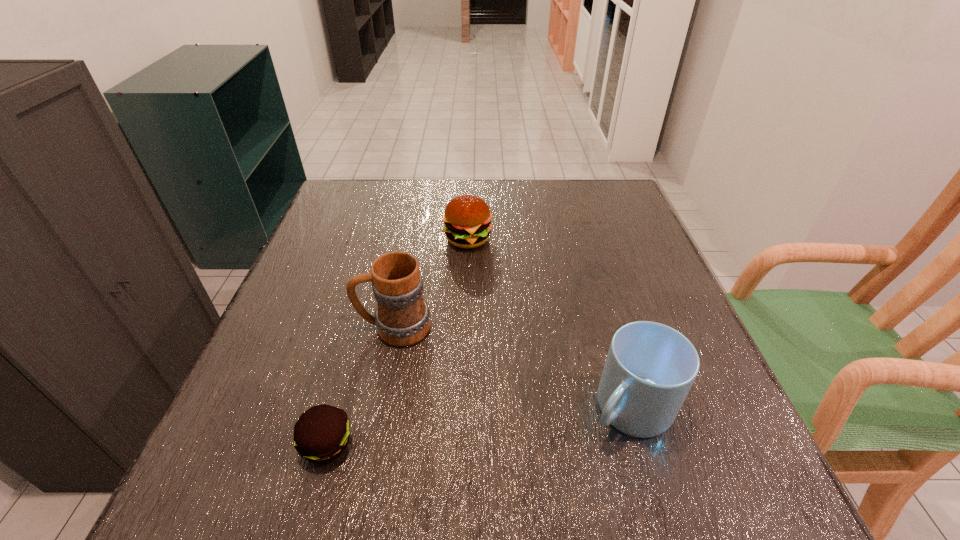
The width and height of the screenshot is (960, 540). Find the location of `unoccupied position between the right mug and the farthest object`. unoccupied position between the right mug and the farthest object is located at coordinates (548, 324).

Identify the location of free area in between the second farthest object and the patty. (360, 386).

The height and width of the screenshot is (540, 960). Identify the location of free point between the nearer mug and the farther mug. (512, 368).

At what (x,y) coordinates should I click in order to perform the action: click on free space between the patty and the rightmost object. Please return your answer as a coordinate pair (x, y). Looking at the image, I should click on (478, 427).

The width and height of the screenshot is (960, 540). Find the location of `free space between the shortest object and the third nearest object`. free space between the shortest object and the third nearest object is located at coordinates (360, 386).

Find the location of a particular element. vacant space in between the second object from right to left and the third nearest object is located at coordinates (431, 283).

This screenshot has width=960, height=540. In order to click on empty location between the farther mug and the rightmost object in this screenshot , I will do `click(512, 368)`.

At what (x,y) coordinates should I click in order to perform the action: click on free spot between the left mug and the farthest object. Please return your answer as a coordinate pair (x, y). Looking at the image, I should click on (431, 283).

Locate an element on the screen. This screenshot has height=540, width=960. free space that is in between the right mug and the shortest object is located at coordinates (478, 427).

Where is `object that stands as the closest to the nearer mug`? The height and width of the screenshot is (540, 960). object that stands as the closest to the nearer mug is located at coordinates (402, 317).